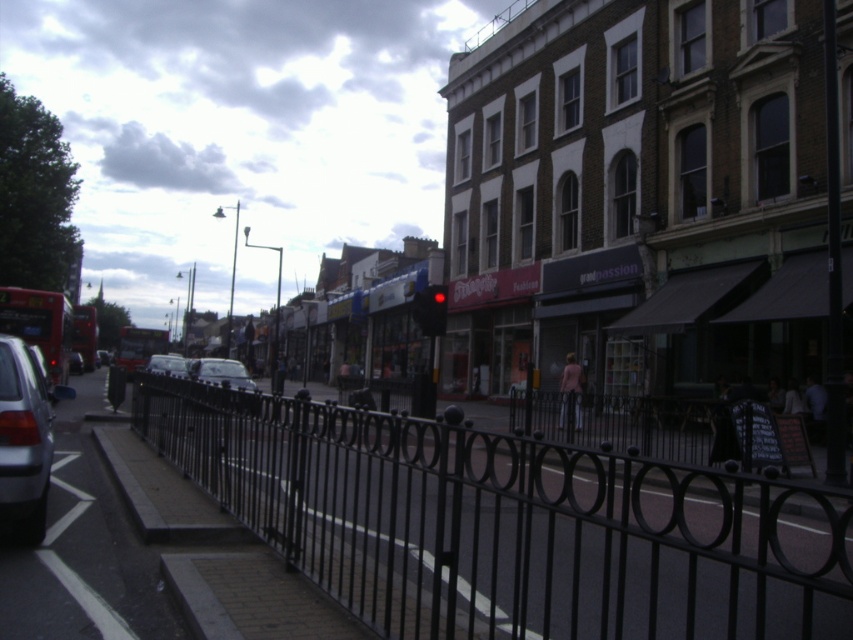
Looking at this image, you are standing on the sidewalk behind the black metal fence and want to take a photo of the silver metallic car at left. Where should you position yourself to capture the point at coordinates (22, 442) on the silver metallic car at left in your camera frame?

The point at coordinates (22, 442) on the silver metallic car at left is located on the car, so you should position yourself directly facing the silver metallic car at left to capture that point in your camera frame.

You are standing at the center of the image and want to walk to the smooth concrete pavement at lower left. Which direction should you move in to reach it?

To reach the smooth concrete pavement at lower left, you should move towards the lower left direction from your current position at the center of the image.

You are a delivery person trying to park your shiny silver car at center in a parking spot that can only accommodate vehicles smaller than the metallic silver car at center. Can your car fit in the spot?

The shiny silver car at center is smaller than the metallic silver car at center, so it can fit in the parking spot designed for vehicles smaller than the metallic silver car at center.